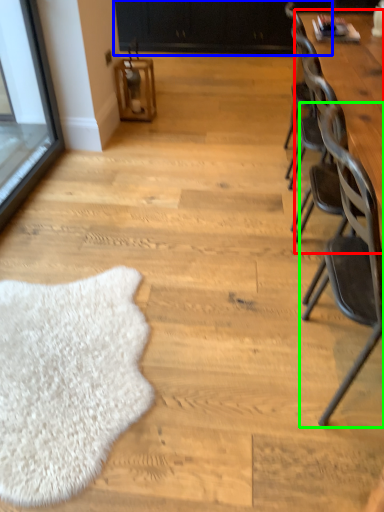
Question: Which object is positioned farthest from table (highlighted by a red box)? Select from dresser (highlighted by a blue box) and chair (highlighted by a green box).

Choices:
 (A) dresser
 (B) chair

Answer: (A)